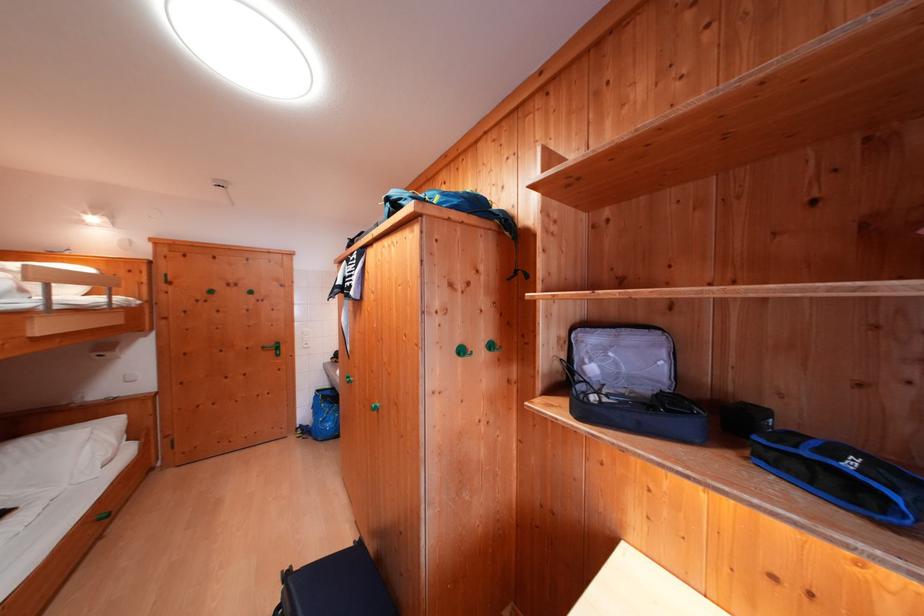
At what (x,y) coordinates should I click in order to perform the action: click on black and blue pouch. Please return your answer as a coordinate pair (x, y). The width and height of the screenshot is (924, 616). Looking at the image, I should click on (842, 475).